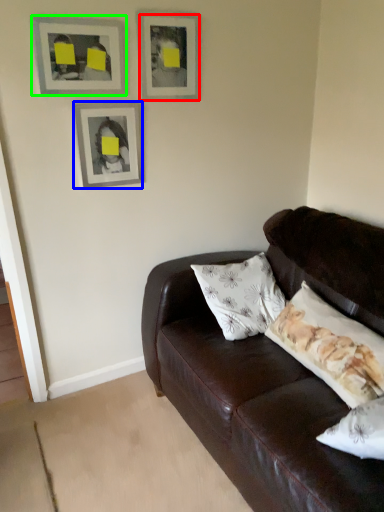
Question: Estimate the real-world distances between objects in this image. Which object is closer to picture frame (highlighted by a red box), picture frame (highlighted by a blue box) or picture frame (highlighted by a green box)?

Choices:
 (A) picture frame
 (B) picture frame

Answer: (B)